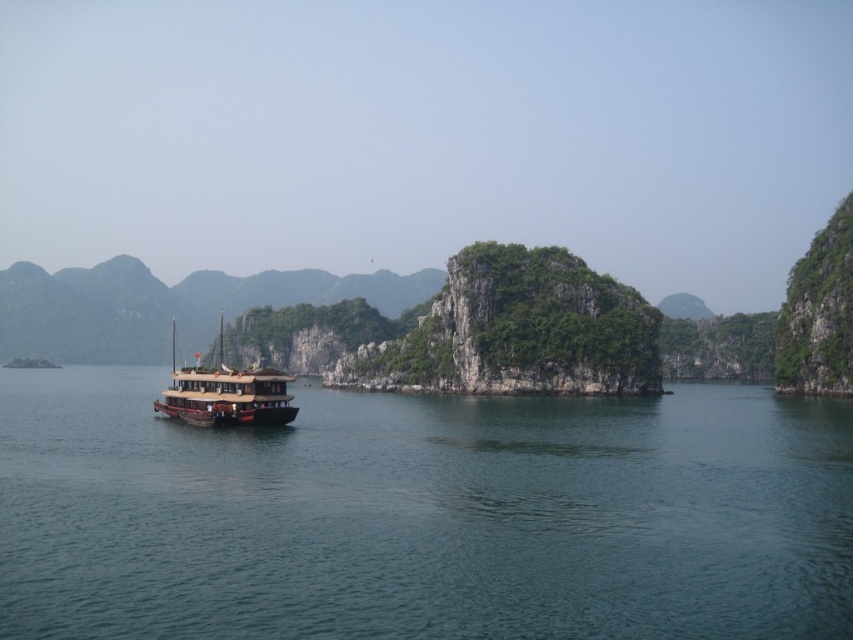
Question: Is green water at lower left thinner than wooden boat at center?

Choices:
 (A) yes
 (B) no

Answer: (A)

Question: Does green water at lower left have a larger size compared to wooden boat at center?

Choices:
 (A) no
 (B) yes

Answer: (A)

Question: Which point is farther to the camera?

Choices:
 (A) wooden boat at center
 (B) green water at lower left

Answer: (A)

Question: Which point is farther to the camera?

Choices:
 (A) [546, 477]
 (B) [236, 394]

Answer: (B)

Question: Which object appears closest to the camera in this image?

Choices:
 (A) wooden boat at center
 (B) green water at lower left

Answer: (B)

Question: Is green water at lower left thinner than wooden boat at center?

Choices:
 (A) no
 (B) yes

Answer: (B)